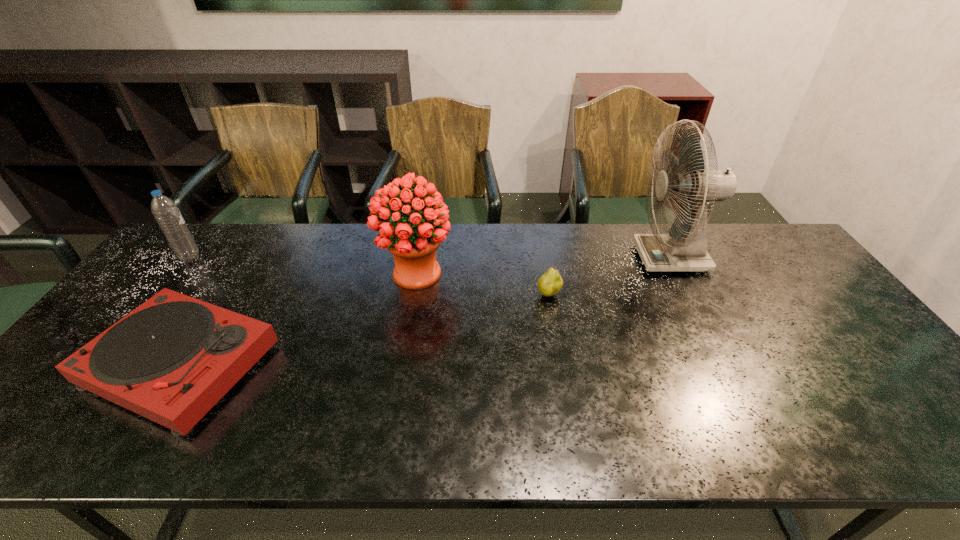
Identify the location of free space between the third shortest object and the second tallest object. This screenshot has width=960, height=540. (303, 265).

You are a GUI agent. You are given a task and a screenshot of the screen. Output one action in this format:
    pyautogui.click(x=<x>, y=<y>)
    Task: Click on the blank region between the second object from right to left and the record player
    
    Given the screenshot: What is the action you would take?
    pyautogui.click(x=366, y=329)

Locate an element on the screen. The image size is (960, 540). free space between the nearest object and the pear is located at coordinates (366, 329).

Where is `free space that is in between the tallest object and the fourth object from left to right`? The image size is (960, 540). free space that is in between the tallest object and the fourth object from left to right is located at coordinates (610, 276).

The height and width of the screenshot is (540, 960). Identify the location of free spot between the third object from left to right and the water bottle. (303, 265).

This screenshot has width=960, height=540. I want to click on free space that is in between the pear and the record player, so click(366, 329).

Identify which object is the fourth closest to the third shortest object. Please provide its 2D coordinates. Your answer should be formatted as a tuple, i.e. [(x, y)], where the tuple contains the x and y coordinates of a point satisfying the conditions above.

[(684, 249)]

Choose which object is the second nearest neighbor to the fourth shortest object. Please provide its 2D coordinates. Your answer should be formatted as a tuple, i.e. [(x, y)], where the tuple contains the x and y coordinates of a point satisfying the conditions above.

[(550, 283)]

Locate an element on the screen. free space that satisfies the following two spatial constraints: 1. on the front side of the record player; 2. on the right side of the water bottle is located at coordinates (105, 364).

Locate an element on the screen. free space that satisfies the following two spatial constraints: 1. on the back side of the pear; 2. on the left side of the nearest object is located at coordinates (226, 295).